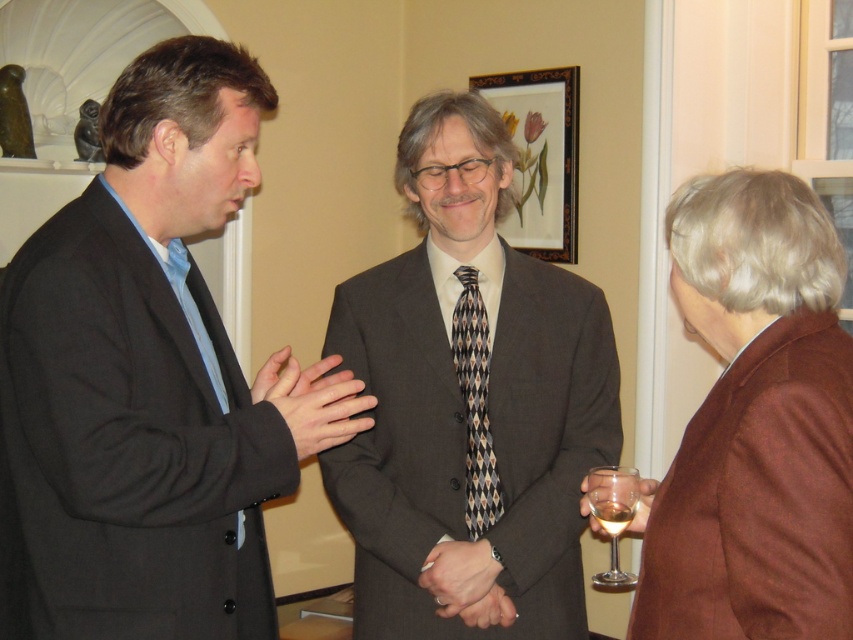
Measure the distance between point (276, 356) and camera.

Point (276, 356) is 5.30 feet away from camera.

Which is in front, point (274, 355) or point (596, 582)?

Positioned in front is point (274, 355).

Where is `matte black hands at center`? The width and height of the screenshot is (853, 640). matte black hands at center is located at coordinates 312,401.

This screenshot has height=640, width=853. Identify the location of matte black hands at center. (312, 401).

In the scene shown: Who is more forward, (248, 173) or (612, 524)?

Positioned in front is point (612, 524).

You are a GUI agent. You are given a task and a screenshot of the screen. Output one action in this format:
    pyautogui.click(x=<x>, y=<y>)
    Task: Click on the matte black suit at left
    
    Given the screenshot: What is the action you would take?
    154,374

The image size is (853, 640). I want to click on matte black suit at left, so click(154, 374).

Can you confirm if black wood picture frame at upper center is thinner than clear glass at lower right?

In fact, black wood picture frame at upper center might be wider than clear glass at lower right.

Does black wood picture frame at upper center have a smaller size compared to clear glass at lower right?

Incorrect, black wood picture frame at upper center is not smaller in size than clear glass at lower right.

The image size is (853, 640). Describe the element at coordinates (540, 156) in the screenshot. I see `black wood picture frame at upper center` at that location.

At what (x,y) coordinates should I click in order to perform the action: click on black wood picture frame at upper center. Please return your answer as a coordinate pair (x, y). This screenshot has height=640, width=853. Looking at the image, I should click on (540, 156).